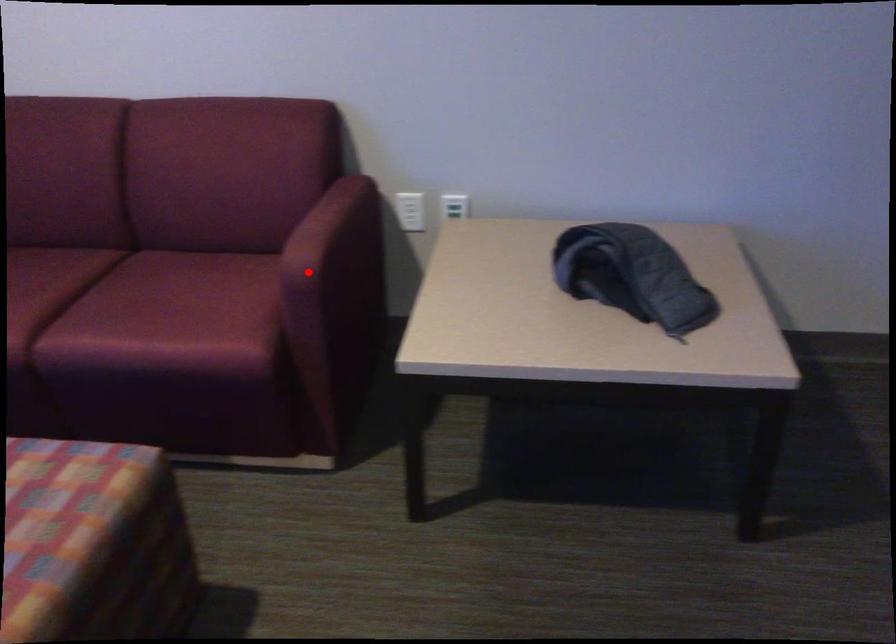
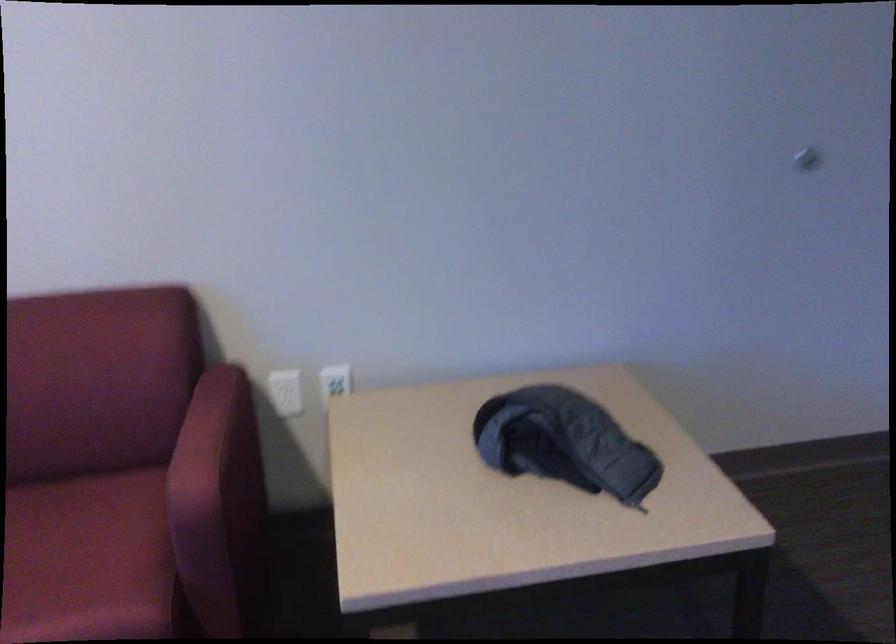
Locate, in the second image, the point that corresponds to the highlighted location in the first image.

(204, 504)